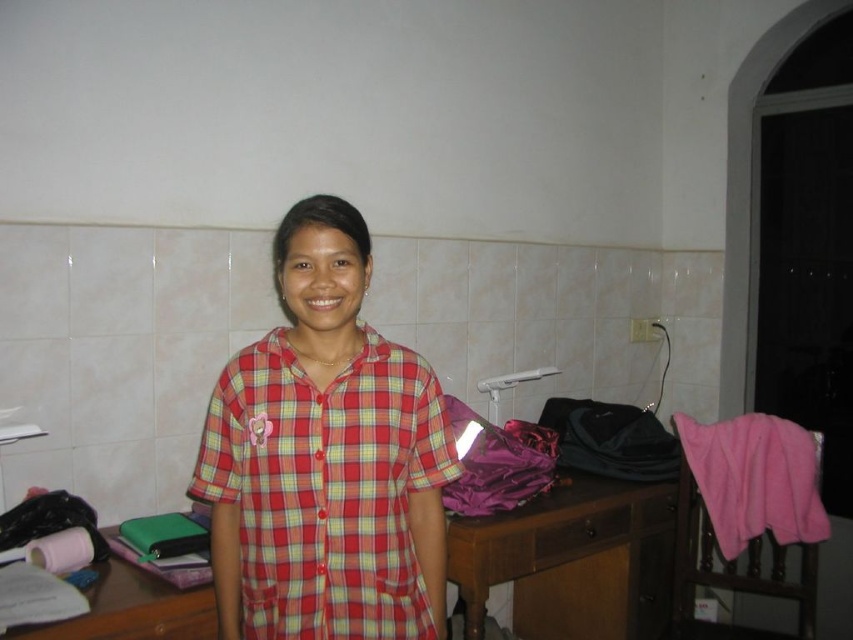
Does red plaid shirt at center have a greater width compared to wooden drawer at center?

Yes.

Is point (410, 438) behind point (563, 531)?

No, it is not.

At what (x,y) coordinates should I click in order to perform the action: click on red plaid shirt at center. Please return your answer as a coordinate pair (x, y). The image size is (853, 640). Looking at the image, I should click on coord(326,486).

Is brown wooden table at lower right bigger than wooden drawer at center?

Indeed, brown wooden table at lower right has a larger size compared to wooden drawer at center.

Can you confirm if brown wooden table at lower right is positioned to the right of wooden drawer at center?

No, brown wooden table at lower right is not to the right of wooden drawer at center.

Does point (648, 532) come behind point (625, 513)?

Yes.

Identify the location of brown wooden table at lower right. (573, 561).

Locate an element on the screen. This screenshot has width=853, height=640. brown wooden table at lower right is located at coordinates (573, 561).

Who is shorter, brown wooden table at lower right or pink fleece blanket at right?

Standing shorter between the two is pink fleece blanket at right.

This screenshot has width=853, height=640. Find the location of `brown wooden table at lower right`. brown wooden table at lower right is located at coordinates (573, 561).